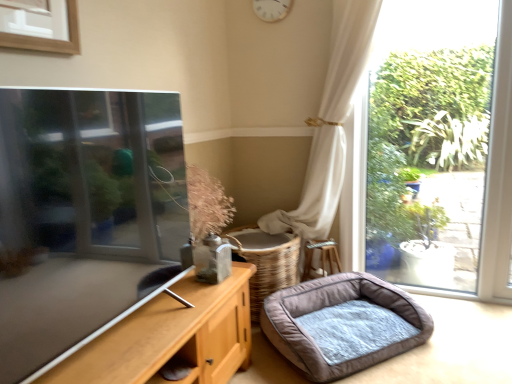
Question: Is white wooden clock at upper center bigger or smaller than gray plush dog bed at lower right?

Choices:
 (A) small
 (B) big

Answer: (A)

Question: Considering the positions of point (280, 3) and point (354, 347), is point (280, 3) closer or farther from the camera than point (354, 347)?

Choices:
 (A) closer
 (B) farther

Answer: (B)

Question: Which is correct: white wooden clock at upper center is inside gray plush dog bed at lower right, or outside of it?

Choices:
 (A) outside
 (B) inside

Answer: (A)

Question: Which is correct: gray plush dog bed at lower right is inside white wooden clock at upper center, or outside of it?

Choices:
 (A) inside
 (B) outside

Answer: (B)

Question: In terms of height, does gray plush dog bed at lower right look taller or shorter compared to white wooden clock at upper center?

Choices:
 (A) tall
 (B) short

Answer: (B)

Question: From a real-world perspective, relative to white wooden clock at upper center, is gray plush dog bed at lower right vertically above or below?

Choices:
 (A) below
 (B) above

Answer: (A)

Question: From the image's perspective, is gray plush dog bed at lower right above or below white wooden clock at upper center?

Choices:
 (A) below
 (B) above

Answer: (A)